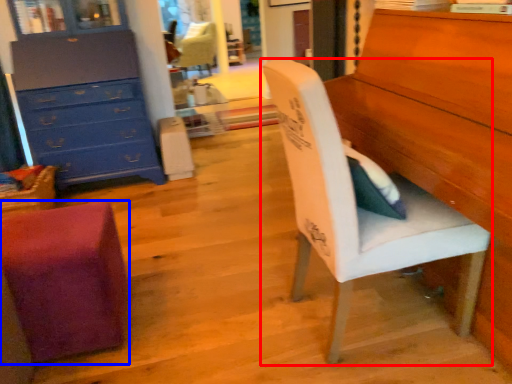
Question: Which point is further to the camera, chair (highlighted by a red box) or chair (highlighted by a blue box)?

Choices:
 (A) chair
 (B) chair

Answer: (B)